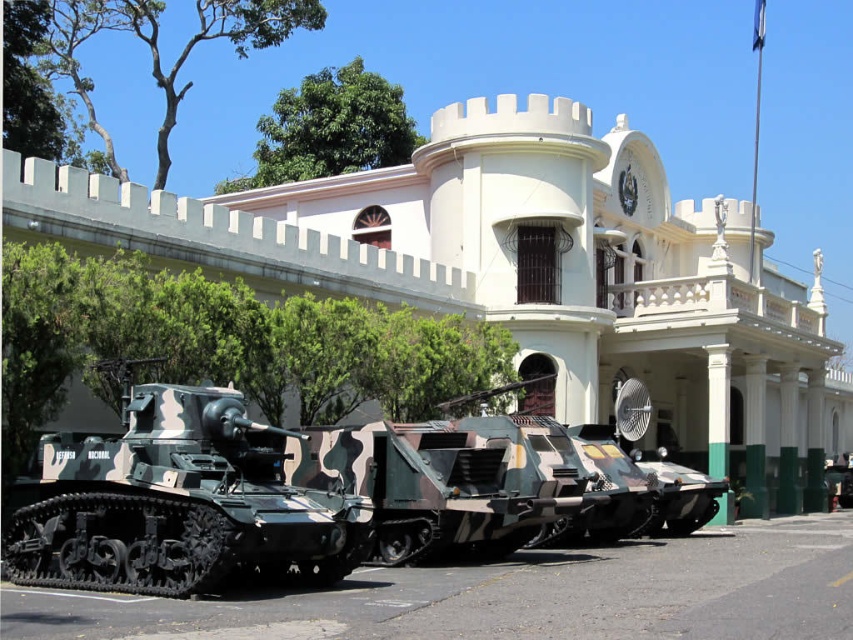
Between point (664, 198) and point (64, 579), which one is positioned behind?

Point (664, 198)

Is white smooth building at center taller than camo-textured tank at center?

Yes.

The image size is (853, 640). What do you see at coordinates (524, 275) in the screenshot?
I see `white smooth building at center` at bounding box center [524, 275].

The width and height of the screenshot is (853, 640). Find the location of `white smooth building at center`. white smooth building at center is located at coordinates (524, 275).

Is point (117, 490) behind point (480, 440)?

No, it is in front of (480, 440).

From the picture: Is camo-textured tank at center thinner than camouflage-patterned tank at center?

Indeed, camo-textured tank at center has a lesser width compared to camouflage-patterned tank at center.

Between point (189, 532) and point (498, 552), which one is positioned behind?

Point (498, 552)

At what (x,y) coordinates should I click in order to perform the action: click on camo-textured tank at center. Please return your answer as a coordinate pair (x, y). Looking at the image, I should click on (173, 500).

Is point (811, 385) behind point (477, 532)?

Yes.

How distant is white smooth building at center from camouflage-patterned tank at center?

They are 68.14 feet apart.

Describe the element at coordinates (524, 275) in the screenshot. I see `white smooth building at center` at that location.

Where is `white smooth building at center`? This screenshot has height=640, width=853. white smooth building at center is located at coordinates (524, 275).